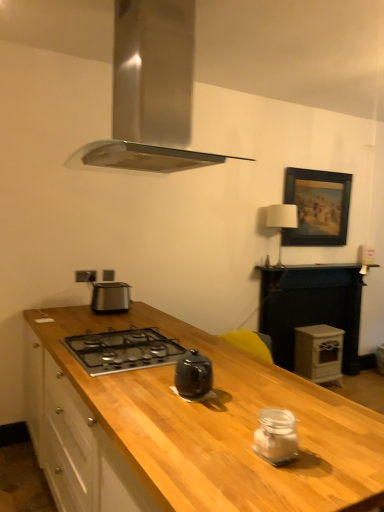
Locate an element on the screen. The image size is (384, 512). vacant space in front of satin silver toaster at center, the 1th kitchen appliance when ordered from top to bottom is located at coordinates (110, 316).